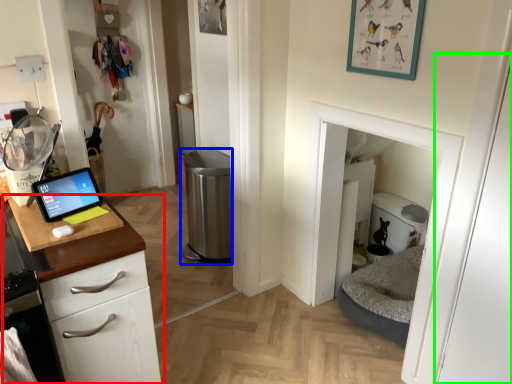
Question: Which object is positioned farthest from cabinetry (highlighted by a red box)? Select from appliance (highlighted by a blue box) and door (highlighted by a green box).

Choices:
 (A) appliance
 (B) door

Answer: (A)